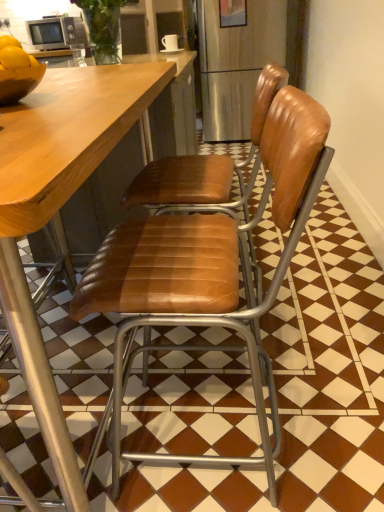
In order to click on vacant area located to the right-hand side of brown leather chair at center, which ranks as the 1th chair in front-to-back order in this screenshot , I will do `click(333, 408)`.